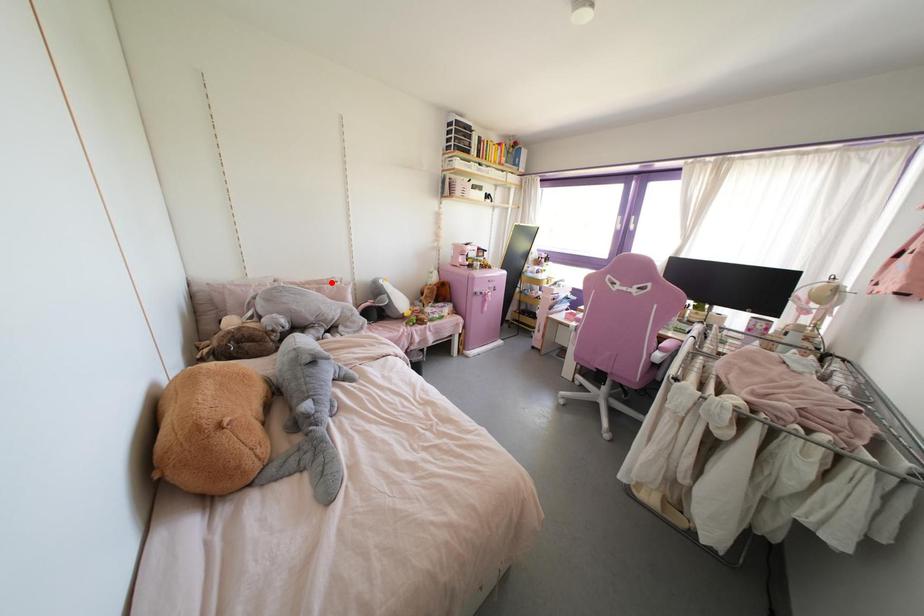
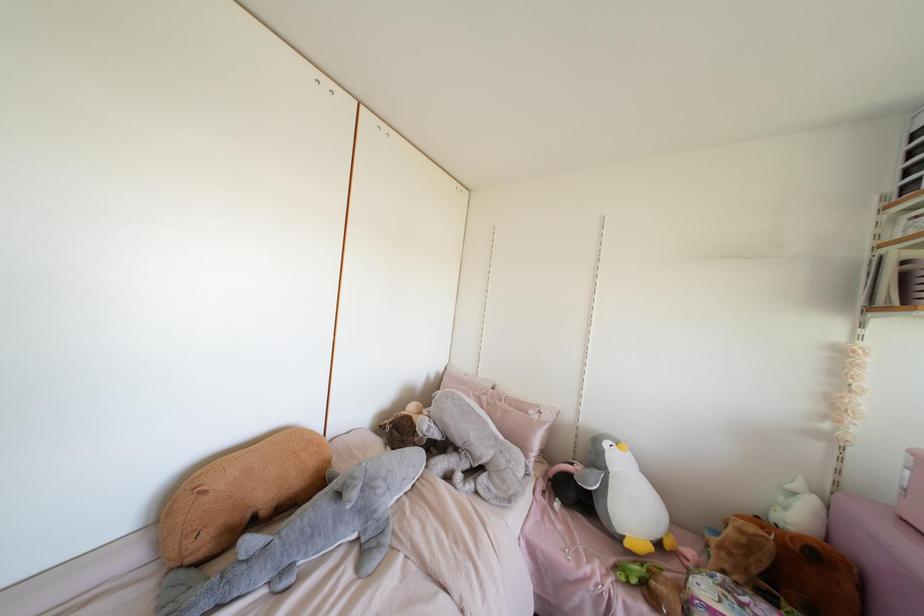
Locate, in the second image, the point that corresponds to the highlighted location in the first image.

(530, 411)